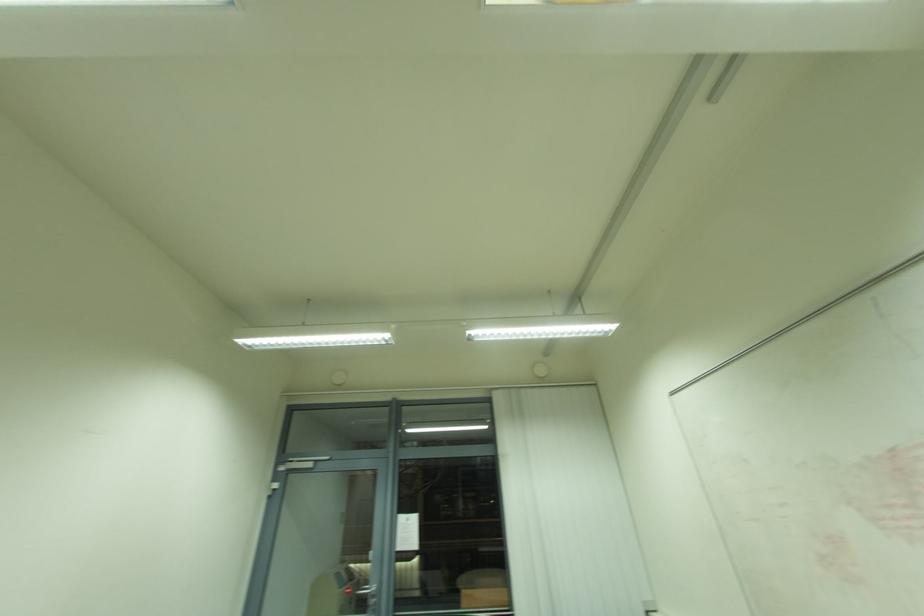
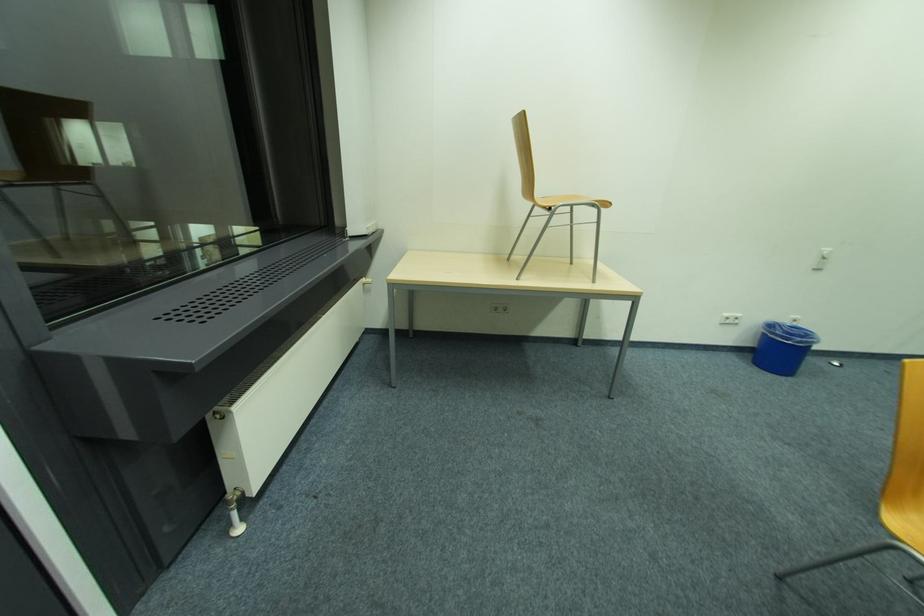
How did the camera likely rotate?

The camera's rotation is toward left-down.